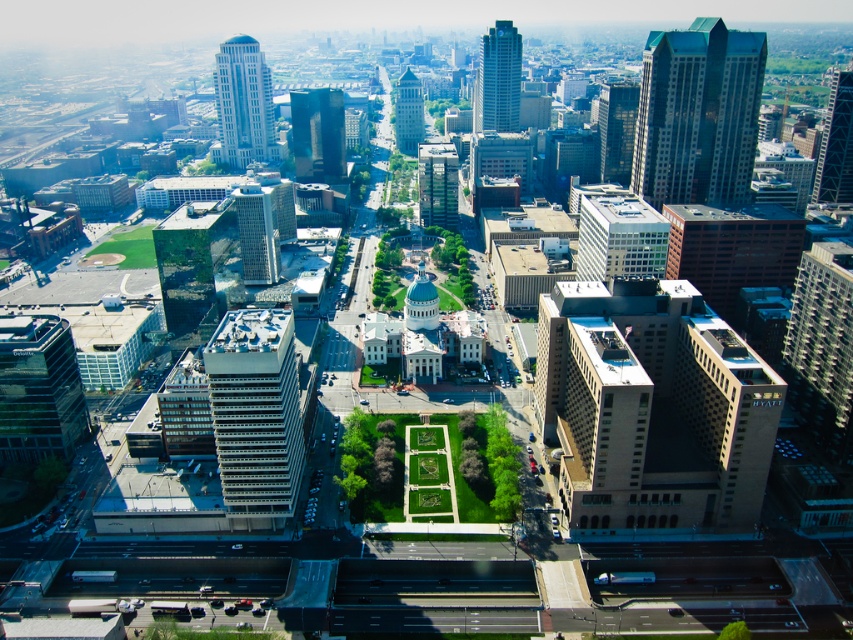
You are standing at the center of the park in the image and want to reach both the point at coordinates (198, 236) and the point at (602, 227). Which point should you head towards first if you want to minimize the distance walked?

You should head towards point (198, 236) first because it is closer to the viewer, meaning it is nearer to your current position at the park center compared to point (602, 227).

From the picture: You are a city planner analyzing the urban layout. You notice two skyscrapers at the upper right corner of the scene. Based on the aerial view, which of the two, the green glass skyscraper at upper right or the glassy reflective skyscraper at upper right, occupies more horizontal space in the city layout?

The green glass skyscraper at upper right might be wider than glassy reflective skyscraper at upper right, so it likely occupies more horizontal space in the city layout.

You are a drone operator who needs to fly a drone through the space between the green glass skyscraper at upper right and the glassy reflective skyscraper at upper right. Can you confirm if there is enough space for the drone to pass between them?

The green glass skyscraper at upper right is in front of the glassy reflective skyscraper at upper right, so there is no space between them for the drone to pass through.